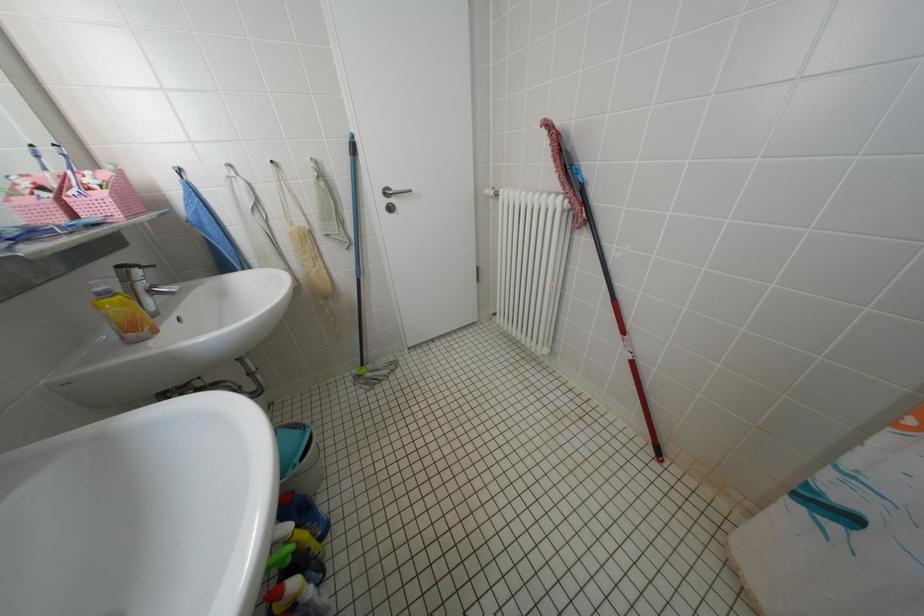
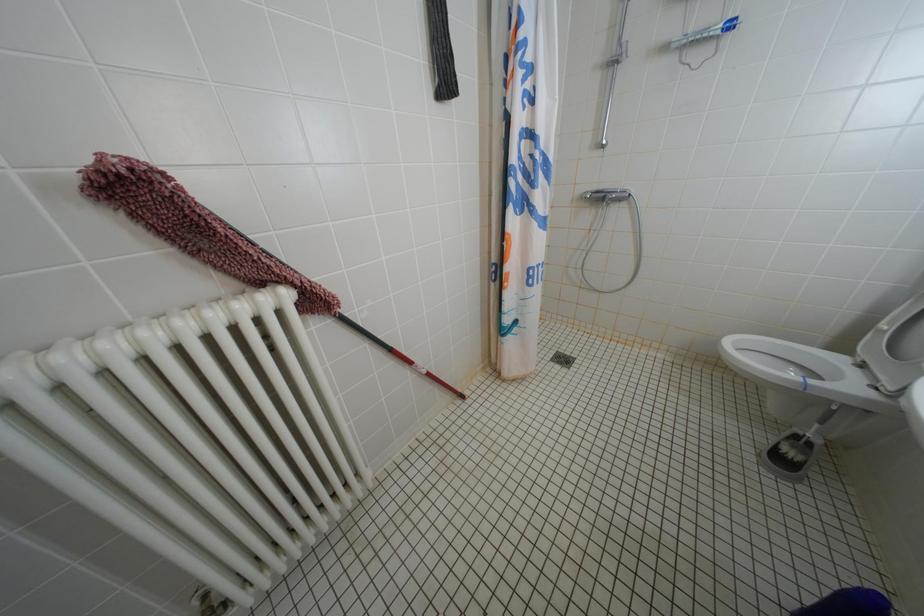
How did the camera likely rotate?

The camera rotated toward right-down.